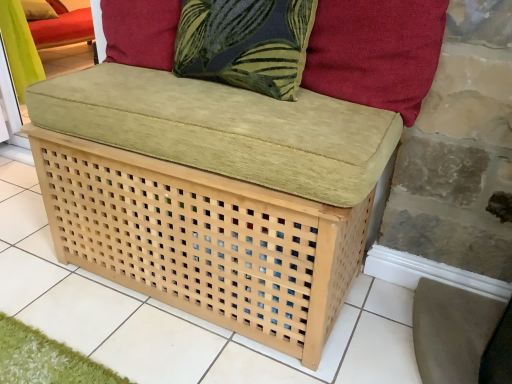
Question: From a real-world perspective, is suede-like red cushion at upper right, positioned as the first pillow in front-to-back order, on top of velvet cushion at upper left, the 2th pillow positioned from the front?

Choices:
 (A) yes
 (B) no

Answer: (A)

Question: Does suede-like red cushion at upper right, the 1th pillow viewed from the right, have a larger size compared to velvet cushion at upper left, acting as the 1th pillow starting from the top?

Choices:
 (A) no
 (B) yes

Answer: (B)

Question: Is velvet cushion at upper left, the 2th pillow positioned from the front, inside suede-like red cushion at upper right, the 2th pillow viewed from the left?

Choices:
 (A) no
 (B) yes

Answer: (A)

Question: Does suede-like red cushion at upper right, the 2th pillow viewed from the left, have a lesser width compared to velvet cushion at upper left, the first pillow in the back-to-front sequence?

Choices:
 (A) no
 (B) yes

Answer: (B)

Question: Considering the relative sizes of suede-like red cushion at upper right, the 2th pillow viewed from the left, and velvet cushion at upper left, acting as the 1th pillow starting from the top, in the image provided, is suede-like red cushion at upper right, the 2th pillow viewed from the left, smaller than velvet cushion at upper left, acting as the 1th pillow starting from the top,?

Choices:
 (A) no
 (B) yes

Answer: (A)

Question: Is suede-like red cushion at upper right, which appears as the second pillow when viewed from the back, facing towards velvet cushion at upper left, the 2th pillow positioned from the front?

Choices:
 (A) yes
 (B) no

Answer: (B)

Question: Is dark blue fabric pillow at upper center to the right of velvet cushion at upper left, which ranks as the 1th pillow in left-to-right order, from the viewer's perspective?

Choices:
 (A) yes
 (B) no

Answer: (A)

Question: Is dark blue fabric pillow at upper center placed right next to velvet cushion at upper left, acting as the 1th pillow starting from the top?

Choices:
 (A) yes
 (B) no

Answer: (B)

Question: Is dark blue fabric pillow at upper center positioned in front of velvet cushion at upper left, the second pillow when ordered from bottom to top?

Choices:
 (A) yes
 (B) no

Answer: (A)

Question: Is dark blue fabric pillow at upper center not within velvet cushion at upper left, the second pillow when ordered from bottom to top?

Choices:
 (A) no
 (B) yes

Answer: (B)

Question: Does dark blue fabric pillow at upper center turn towards velvet cushion at upper left, the 2th pillow positioned from the front?

Choices:
 (A) yes
 (B) no

Answer: (B)

Question: From a real-world perspective, is dark blue fabric pillow at upper center located higher than velvet cushion at upper left, which appears as the second pillow when viewed from the right?

Choices:
 (A) no
 (B) yes

Answer: (B)

Question: From a real-world perspective, is dark blue fabric pillow at upper center located beneath suede-like red cushion at upper right, which appears as the second pillow when viewed from the back?

Choices:
 (A) no
 (B) yes

Answer: (B)